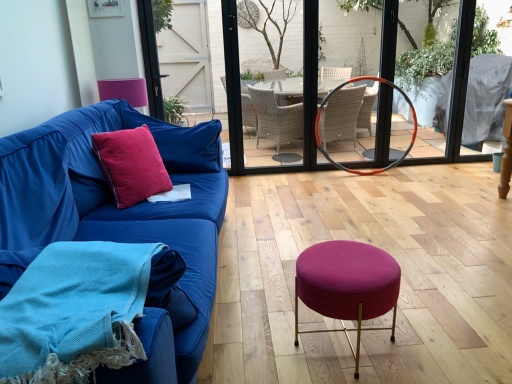
Question: Is orange rubber hula hoop at center spatially inside velvet cushion at left, or outside of it?

Choices:
 (A) inside
 (B) outside

Answer: (B)

Question: Does point (369, 77) appear closer or farther from the camera than point (138, 140)?

Choices:
 (A) closer
 (B) farther

Answer: (B)

Question: Estimate the real-world distances between objects in this image. Which object is farther from the velvet magenta stool at center?

Choices:
 (A) orange rubber hula hoop at center
 (B) clear glass door at center
 (C) velvet cushion at left
 (D) woolen blue blanket at lower left
 (E) pink velvet pillow at left

Answer: (B)

Question: Which object is the closest to the velvet magenta stool at center?

Choices:
 (A) orange rubber hula hoop at center
 (B) blue fabric couch at left
 (C) woolen blue blanket at lower left
 (D) velvet cushion at left
 (E) pink velvet armchair at upper left

Answer: (B)